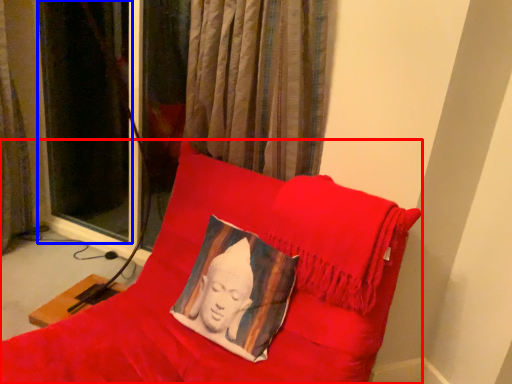
Question: Which object is further to the camera taking this photo, furniture (highlighted by a red box) or curtain (highlighted by a blue box)?

Choices:
 (A) furniture
 (B) curtain

Answer: (B)